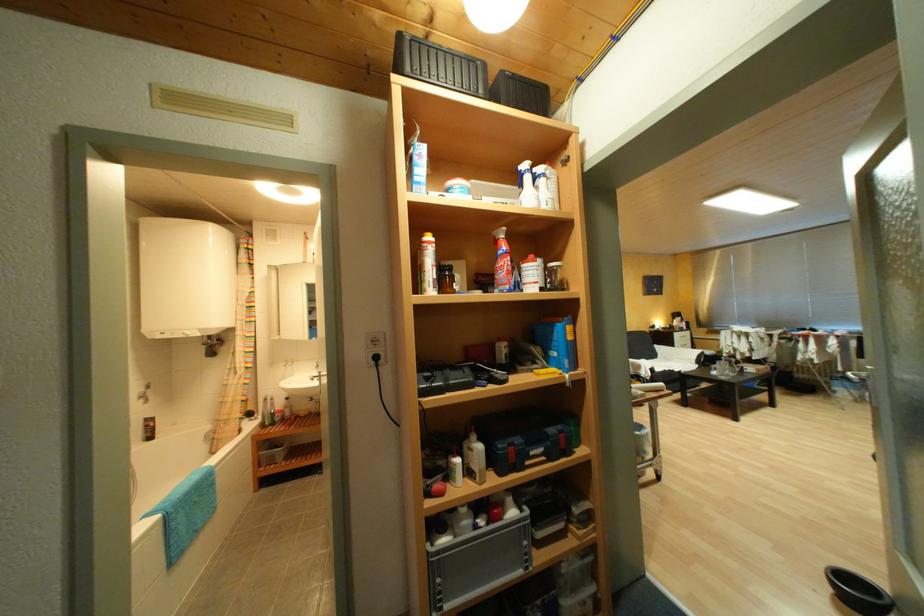
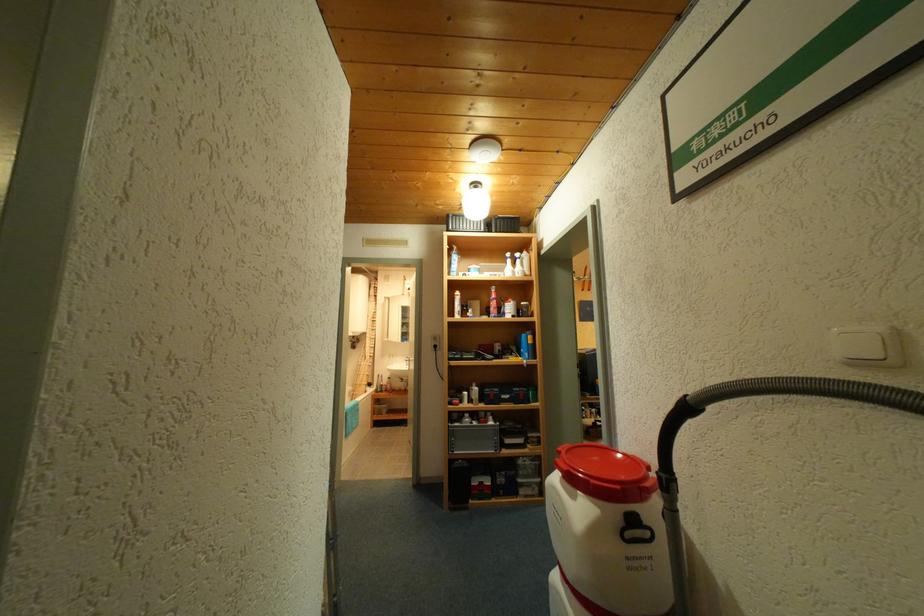
Locate, in the second image, the point that corresponds to the point at 482,438 in the first image.

(483, 386)